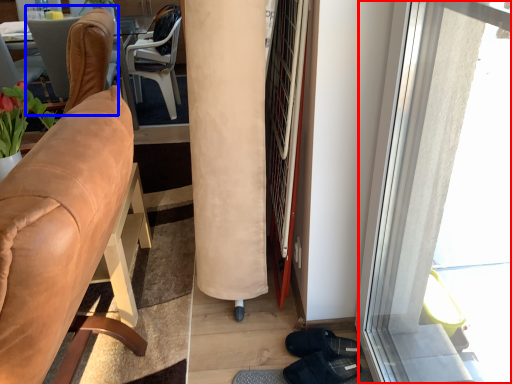
Question: Which of the following is the farthest to the observer, window (highlighted by a red box) or chair (highlighted by a blue box)?

Choices:
 (A) window
 (B) chair

Answer: (B)